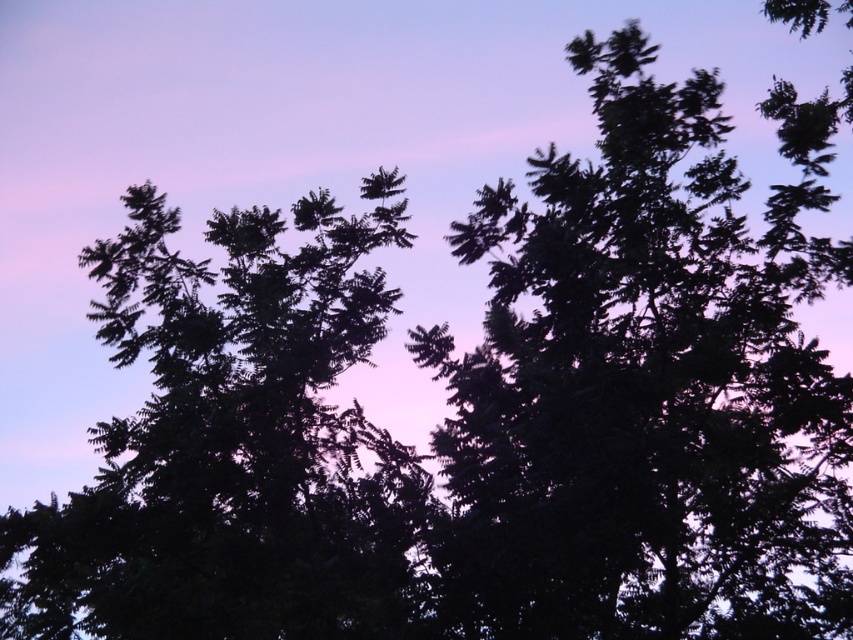
You are standing in a forest at twilight and notice a specific point in the scene. Can you identify which object is positioned at the coordinates point (647,387)?

The dark green foliage at center is located at point (647,387).

You are an artist sketching the scene and want to draw the dark green foliage at center and the dark green leafy tree at upper left. Which one should you draw first if you follow the standard left to right drawing technique?

The dark green leafy tree at upper left should be drawn first because it is positioned to the left of the dark green foliage at center, following the left to right drawing technique.